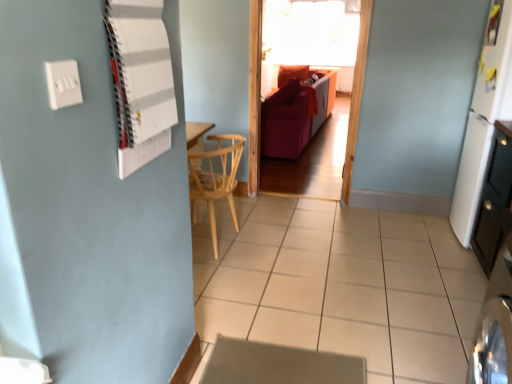
Question: From the image's perspective, is transparent glass window at upper center on top of white plastic switch at upper left?

Choices:
 (A) no
 (B) yes

Answer: (B)

Question: Is transparent glass window at upper center directly adjacent to white plastic switch at upper left?

Choices:
 (A) yes
 (B) no

Answer: (B)

Question: Is transparent glass window at upper center thinner than white plastic switch at upper left?

Choices:
 (A) yes
 (B) no

Answer: (B)

Question: Considering the relative sizes of transparent glass window at upper center and white plastic switch at upper left in the image provided, is transparent glass window at upper center wider than white plastic switch at upper left?

Choices:
 (A) yes
 (B) no

Answer: (A)

Question: Is transparent glass window at upper center shorter than white plastic switch at upper left?

Choices:
 (A) yes
 (B) no

Answer: (B)

Question: From a real-world perspective, is transparent glass window at upper center positioned under white plastic switch at upper left based on gravity?

Choices:
 (A) no
 (B) yes

Answer: (A)

Question: Does white matte refrigerator at right have a greater height compared to white matte board at upper left?

Choices:
 (A) no
 (B) yes

Answer: (B)

Question: Does white matte refrigerator at right turn towards white matte board at upper left?

Choices:
 (A) yes
 (B) no

Answer: (B)

Question: Is white matte refrigerator at right outside of white matte board at upper left?

Choices:
 (A) yes
 (B) no

Answer: (A)

Question: Is the depth of white matte refrigerator at right greater than that of white matte board at upper left?

Choices:
 (A) yes
 (B) no

Answer: (A)

Question: From a real-world perspective, is white matte refrigerator at right positioned over white matte board at upper left based on gravity?

Choices:
 (A) no
 (B) yes

Answer: (A)

Question: Can you confirm if white matte refrigerator at right is bigger than white matte board at upper left?

Choices:
 (A) yes
 (B) no

Answer: (A)

Question: Can you confirm if velvet red couch at center is thinner than beige carpet at lower center?

Choices:
 (A) no
 (B) yes

Answer: (A)